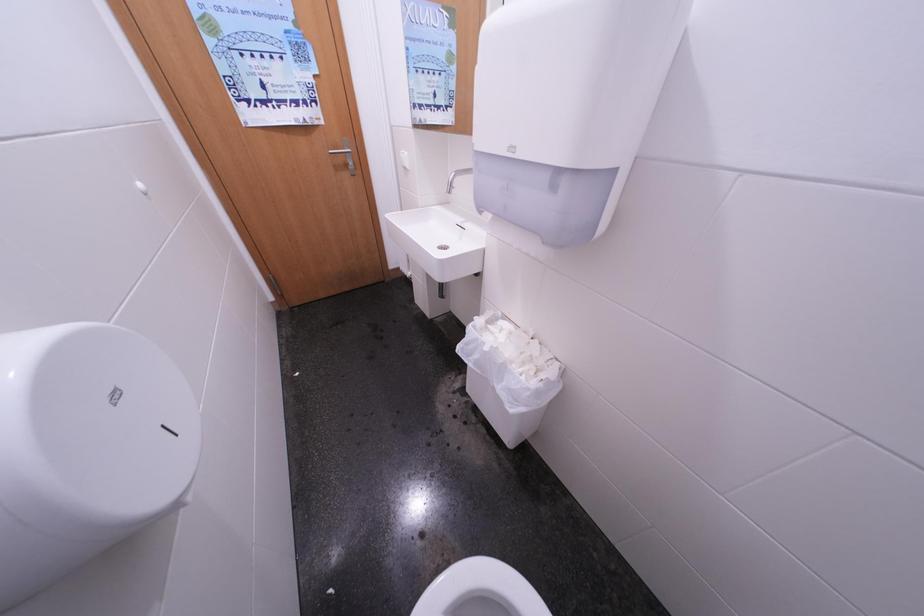
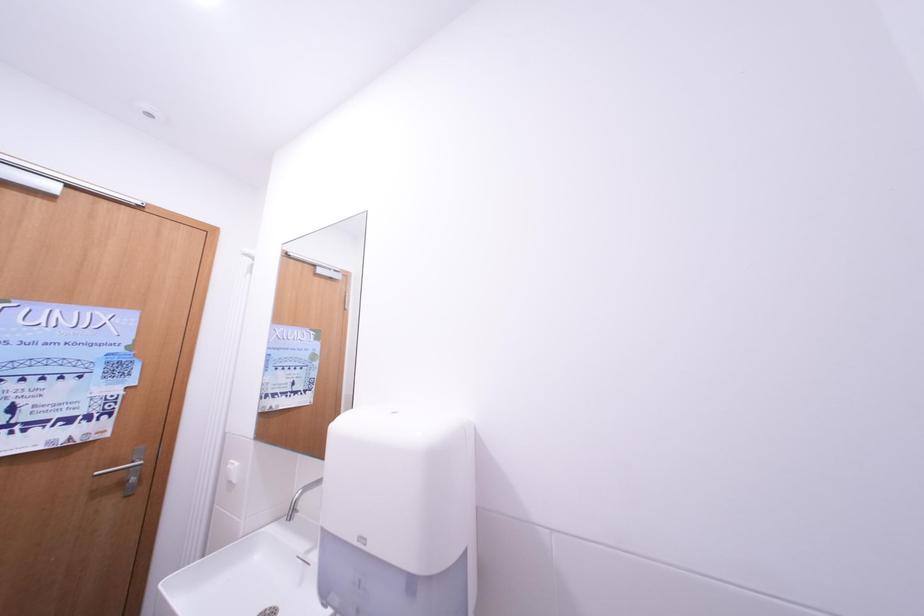
Based on the continuous images, in which direction is the camera rotating?

The camera's rotation is toward right-up.